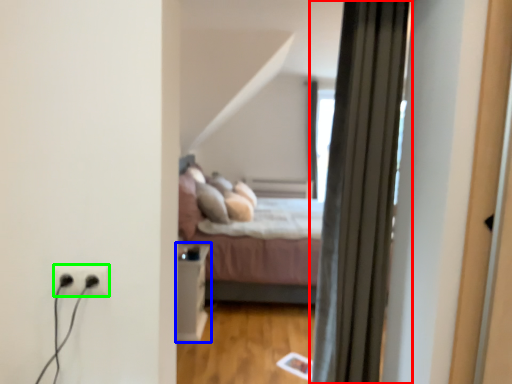
Question: Considering the real-world distances, which object is farthest from curtain (highlighted by a red box)? table (highlighted by a blue box) or electric outlet (highlighted by a green box)?

Choices:
 (A) table
 (B) electric outlet

Answer: (A)